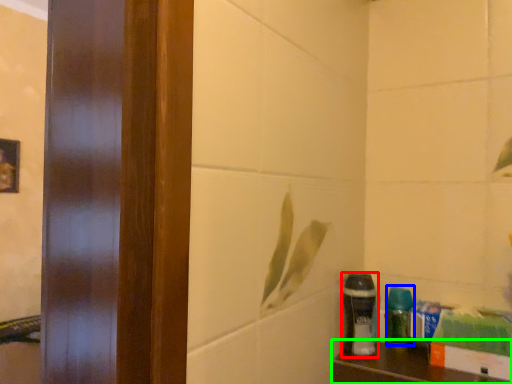
Question: Which object is positioned closest to shaving cream (highlighted by a red box)? Select from cleaning product (highlighted by a blue box) and furniture (highlighted by a green box).

Choices:
 (A) cleaning product
 (B) furniture

Answer: (A)